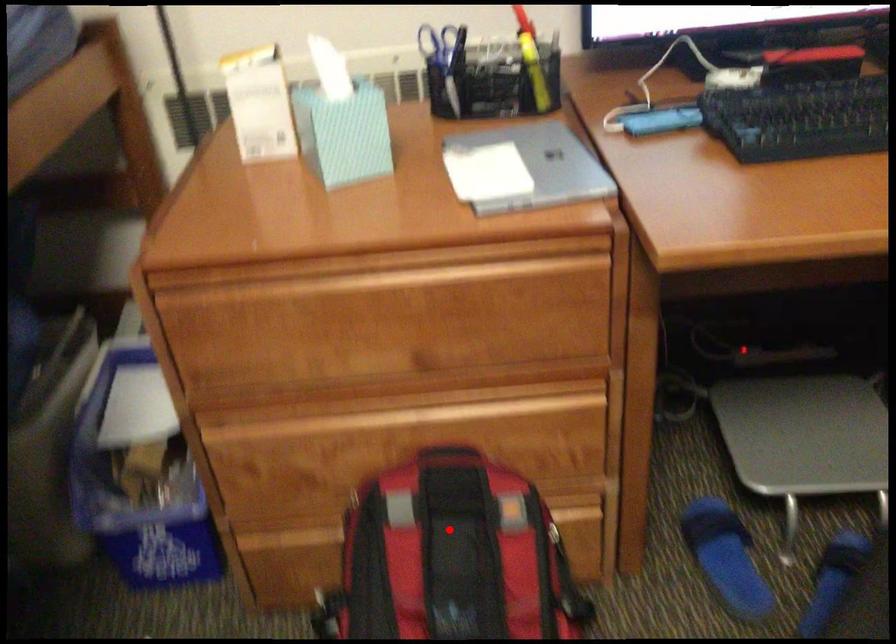
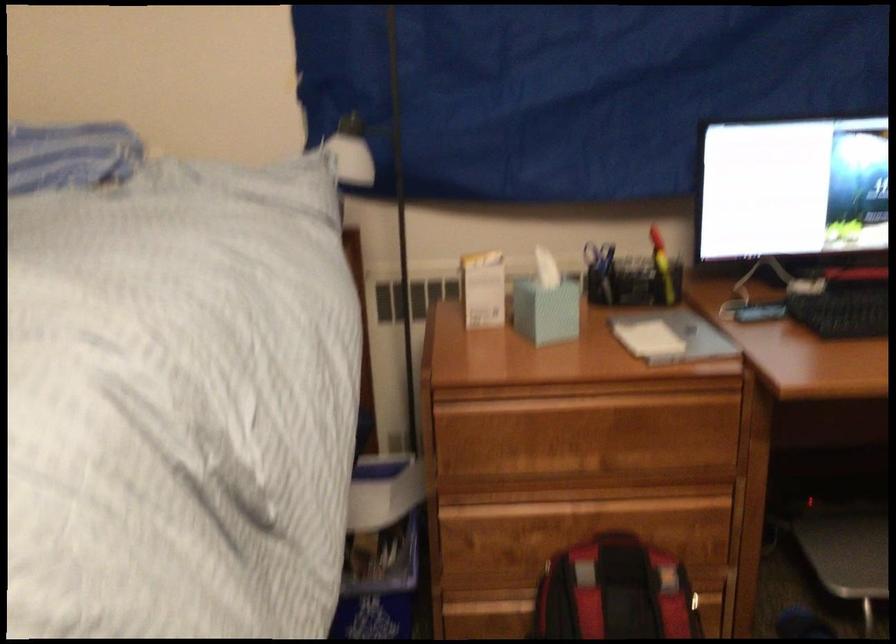
Question: I am providing you with two images of the same scene from different viewpoints. In image1, a red point is highlighted. Considering the same 3D point in image2, which of the following is correct?

Choices:
 (A) It is closer
 (B) It is farther

Answer: (B)